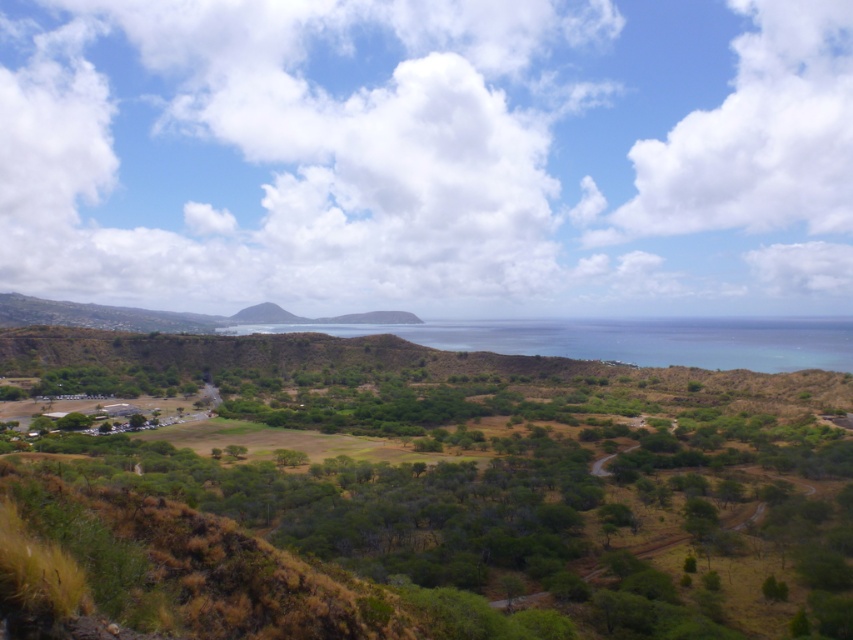
Does blue water at center appear on the left side of green grassy hill at center?

No, blue water at center is not to the left of green grassy hill at center.

Which is more to the right, blue water at center or green grassy hill at center?

Positioned to the right is blue water at center.

Who is more forward, (440,337) or (254,314)?

Point (440,337) is in front.

Image resolution: width=853 pixels, height=640 pixels. I want to click on blue water at center, so click(627, 339).